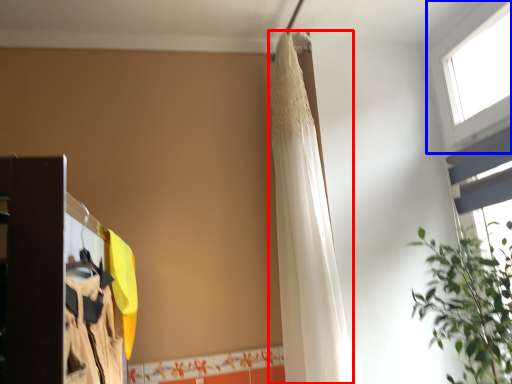
Question: Among these objects, which one is nearest to the camera, shower curtain (highlighted by a red box) or window (highlighted by a blue box)?

Choices:
 (A) shower curtain
 (B) window

Answer: (B)